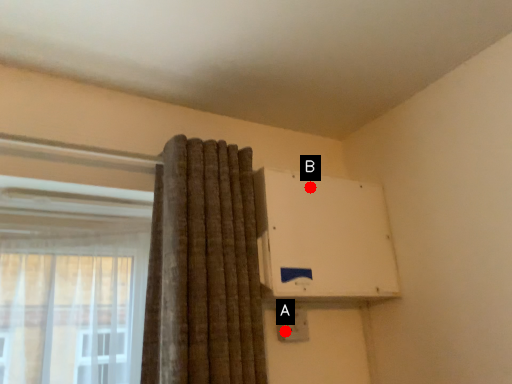
Question: Two points are circled on the image, labeled by A and B beside each circle. Which point appears closest to the camera in this image?

Choices:
 (A) A is closer
 (B) B is closer

Answer: (A)